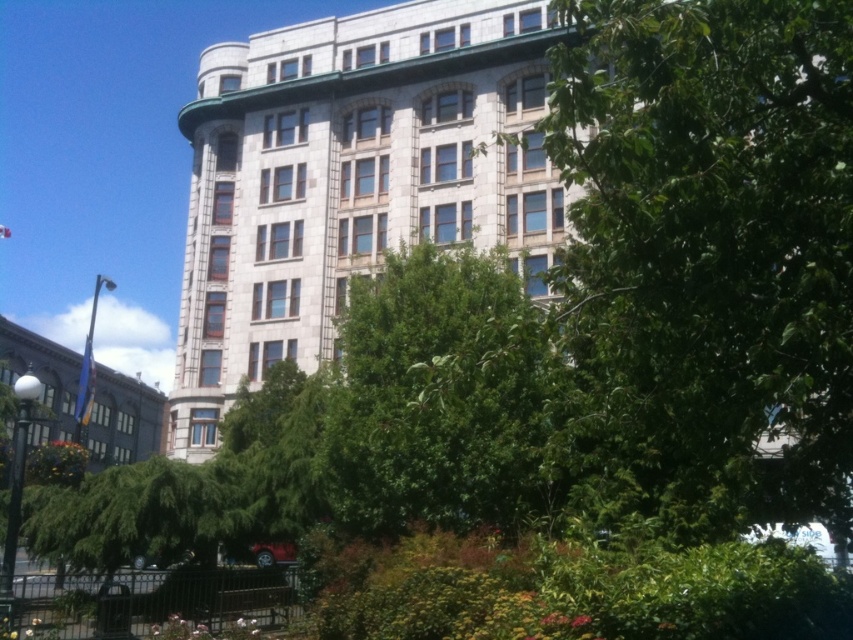
Question: Can you confirm if green leafy tree at upper center is thinner than stone building at center?

Choices:
 (A) no
 (B) yes

Answer: (B)

Question: Which of these objects is positioned closest to the green leafy tree at center?

Choices:
 (A) stone building at center
 (B) matte gray building at left

Answer: (A)

Question: Which object is positioned closest to the stone building at center?

Choices:
 (A) green leafy tree at center
 (B) matte gray building at left
 (C) green leafy tree at upper center

Answer: (A)

Question: Which of these objects is positioned closest to the green leafy tree at center?

Choices:
 (A) matte gray building at left
 (B) green leafy tree at upper center

Answer: (B)

Question: Can you confirm if stone building at center is thinner than green leafy tree at center?

Choices:
 (A) yes
 (B) no

Answer: (B)

Question: Does stone building at center have a smaller size compared to green leafy tree at center?

Choices:
 (A) yes
 (B) no

Answer: (B)